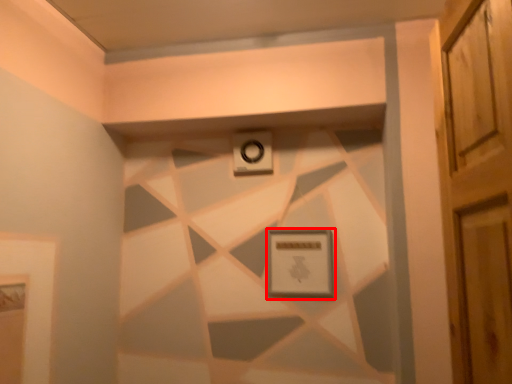
Question: Considering the relative positions of picture frame (annotated by the red box) and alarm in the image provided, where is picture frame (annotated by the red box) located with respect to the staircase?

Choices:
 (A) left
 (B) right

Answer: (B)